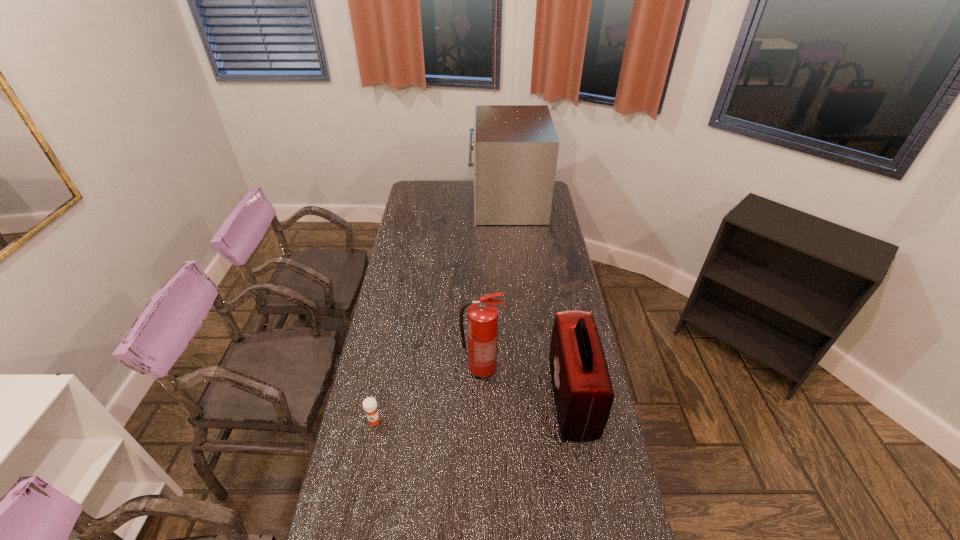
This screenshot has width=960, height=540. What are the coordinates of `free location located 0.340m on the side of the second shortest object with the cross symbol` in the screenshot? It's located at (449, 398).

I want to click on free spot located on the side of the second shortest object with the cross symbol, so click(x=465, y=398).

This screenshot has height=540, width=960. In order to click on vacant space located on the side of the second shortest object with the cross symbol in this screenshot , I will do `click(531, 398)`.

I want to click on vacant space located on the label side of the shortest object, so click(358, 504).

The image size is (960, 540). Find the location of `object located at the far edge`. object located at the far edge is located at coordinates click(515, 147).

The image size is (960, 540). In order to click on object present at the left edge in this screenshot , I will do [369, 404].

This screenshot has height=540, width=960. In order to click on toaster oven that is positioned at the right edge in this screenshot , I will do `click(515, 147)`.

The image size is (960, 540). In order to click on the first aid kit that is positioned at the right edge in this screenshot , I will do `click(583, 393)`.

Find the location of `object situated at the far right corner`. object situated at the far right corner is located at coordinates (515, 147).

Locate an element on the screen. Image resolution: width=960 pixels, height=540 pixels. vacant space at the left edge is located at coordinates (405, 311).